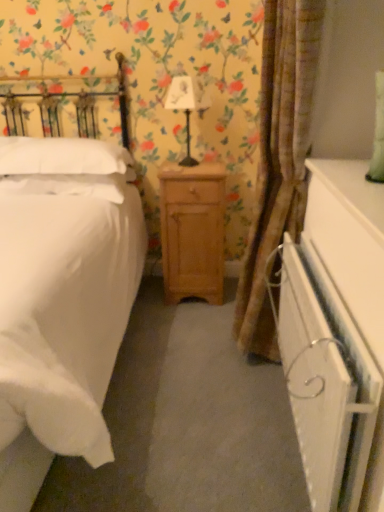
Identify the location of vacant space that's between light brown wood nightstand at center and brown textured curtain at center. The height and width of the screenshot is (512, 384). (203, 336).